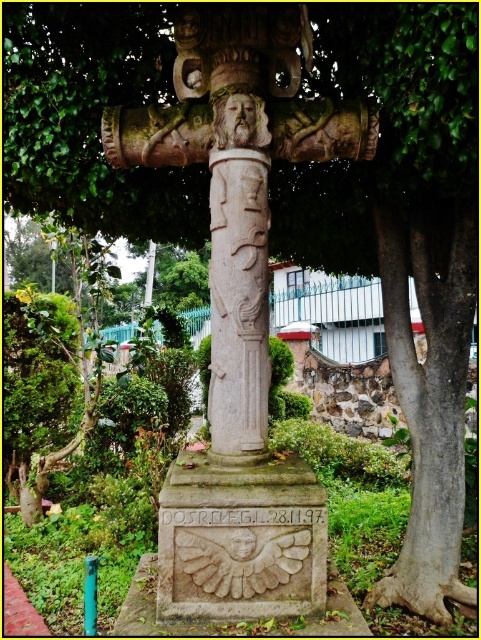
Image resolution: width=481 pixels, height=640 pixels. Describe the element at coordinates (240, 177) in the screenshot. I see `carved stone column at center` at that location.

Looking at this image, does carved stone column at center have a lesser height compared to white stone column at center?

No, carved stone column at center is not shorter than white stone column at center.

Does point (227, 316) come farther from viewer compared to point (240, 333)?

Yes, it is.

Locate an element on the screen. This screenshot has height=640, width=481. carved stone column at center is located at coordinates (240, 177).